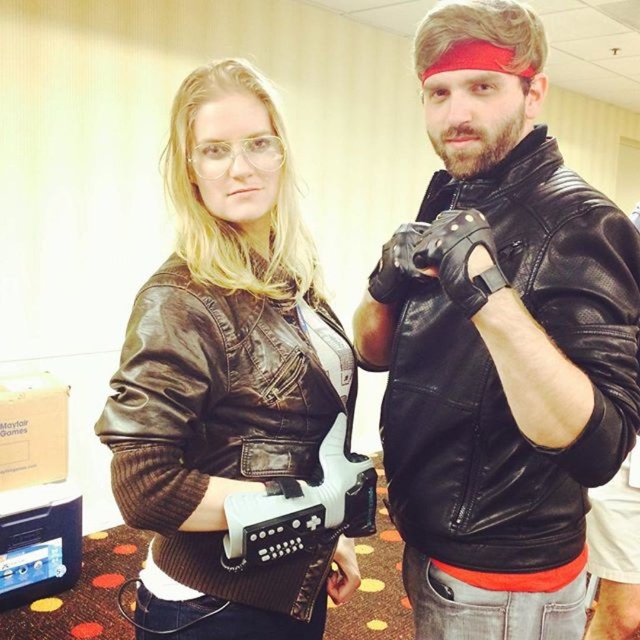
Question: Is black leather jacket at center to the right of brown leather jacket at center from the viewer's perspective?

Choices:
 (A) no
 (B) yes

Answer: (B)

Question: Which object is closer to the camera taking this photo?

Choices:
 (A) black leather jacket at center
 (B) brown leather jacket at center

Answer: (A)

Question: Is black leather jacket at center smaller than brown leather jacket at center?

Choices:
 (A) no
 (B) yes

Answer: (A)

Question: Which point appears farthest from the camera in this image?

Choices:
 (A) (477, 326)
 (B) (250, 301)

Answer: (B)

Question: Which object appears farthest from the camera in this image?

Choices:
 (A) brown leather jacket at center
 (B) black leather jacket at center

Answer: (A)

Question: Observing the image, what is the correct spatial positioning of black leather jacket at center in reference to brown leather jacket at center?

Choices:
 (A) below
 (B) above

Answer: (B)